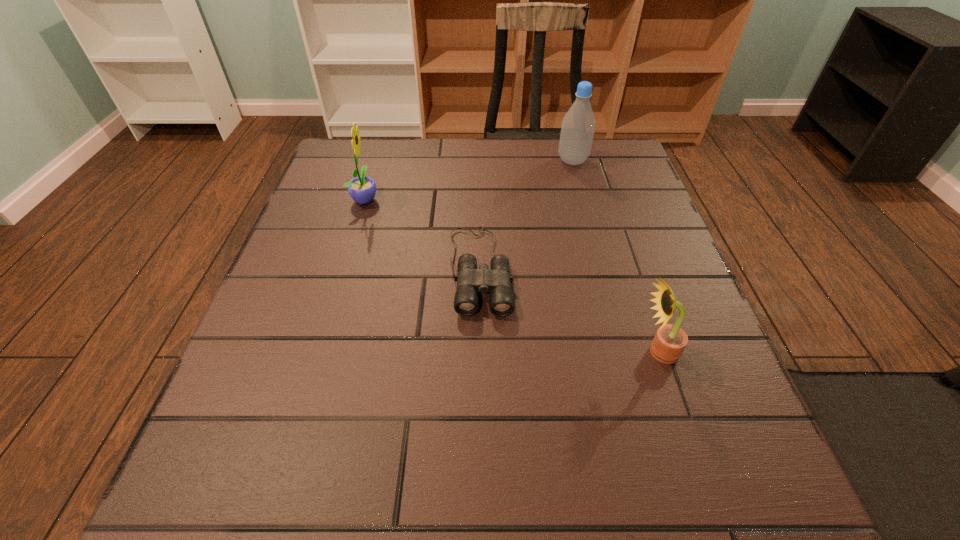
Find the location of a particular element. Image resolution: width=960 pixels, height=540 pixels. vacant space at the far edge of the desktop is located at coordinates (487, 172).

The image size is (960, 540). Identify the location of blank space at the near edge. (445, 512).

In the image, there is a desktop. Identify the location of vacant region at the left edge. This screenshot has height=540, width=960. coord(263,374).

At what (x,y) coordinates should I click in order to perform the action: click on vacant point at the right edge. Please return your answer as a coordinate pair (x, y). The width and height of the screenshot is (960, 540). Looking at the image, I should click on (679, 272).

In order to click on free space at the far left corner of the desktop in this screenshot , I will do `click(343, 141)`.

The width and height of the screenshot is (960, 540). Identify the location of free space that is in between the nearest object and the farthest object. (615, 256).

Where is `free space between the second shortest object and the farthest object`? free space between the second shortest object and the farthest object is located at coordinates (615, 256).

Identify the location of free area in between the farther sunflower and the nearest object. This screenshot has height=540, width=960. (512, 275).

At what (x,y) coordinates should I click in order to perform the action: click on vacant area between the left sunflower and the binoculars. Please return your answer as a coordinate pair (x, y). The image size is (960, 540). Looking at the image, I should click on (422, 234).

Locate an element on the screen. unoccupied position between the nearest object and the third nearest object is located at coordinates (512, 275).